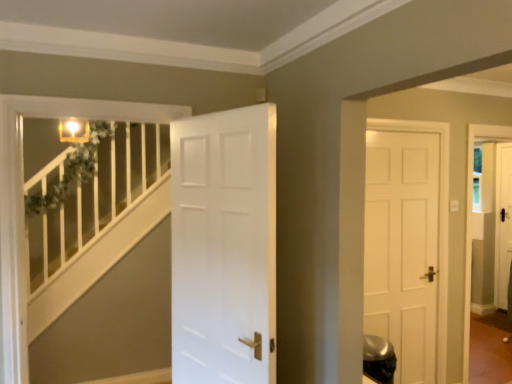
Question: Based on their positions, is white matte door at center located to the left or right of white painted wood balustrade at left?

Choices:
 (A) left
 (B) right

Answer: (B)

Question: Considering the positions of point (186, 294) and point (147, 144), is point (186, 294) closer or farther from the camera than point (147, 144)?

Choices:
 (A) closer
 (B) farther

Answer: (A)

Question: Considering the positions of white matte door at center and white painted wood balustrade at left in the image, is white matte door at center taller or shorter than white painted wood balustrade at left?

Choices:
 (A) tall
 (B) short

Answer: (A)

Question: From a real-world perspective, is white painted wood balustrade at left physically located above or below white matte door at center?

Choices:
 (A) above
 (B) below

Answer: (B)

Question: Is point (61, 180) closer or farther from the camera than point (266, 266)?

Choices:
 (A) farther
 (B) closer

Answer: (A)

Question: Is white painted wood balustrade at left bigger or smaller than white matte door at center?

Choices:
 (A) big
 (B) small

Answer: (B)

Question: From the image's perspective, is white painted wood balustrade at left positioned above or below white matte door at center?

Choices:
 (A) below
 (B) above

Answer: (A)